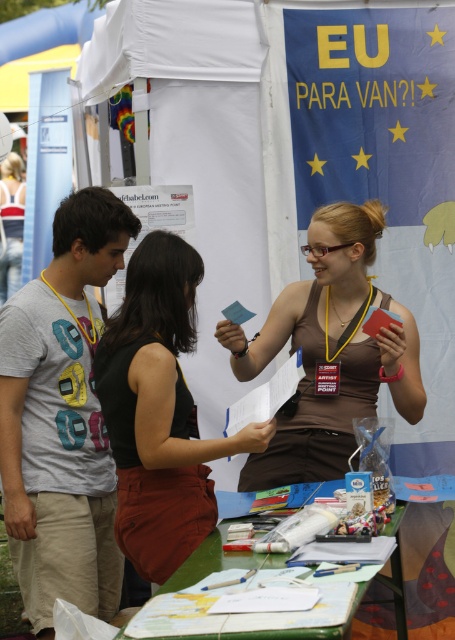
You are standing at the point labeled point (1,269) and want to walk towards the point labeled point (29,572). Which direction should you face to move directly towards it?

You should face forward because point (29,572) is in front of point (1,269).

You are a visitor at the fair and want to place a souvenir on the green painted wood table at lower center. However, you notice the matte black tank top at center is currently on the table. Can the souvenir fit on the table without moving the tank top?

The green painted wood table at lower center is shorter than the matte black tank top at center, meaning the tank top is taller than the table. Since the tank top is already on the table, there may not be enough vertical space left for the souvenir unless it is very small.